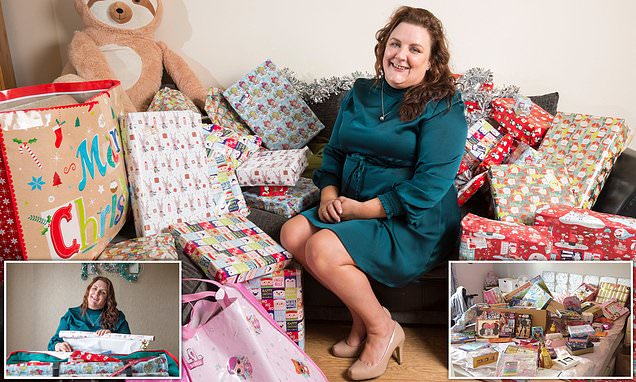
The width and height of the screenshot is (636, 382). Identify the location of gifts in red paper. (493, 246), (589, 230), (528, 117), (509, 146), (474, 189), (266, 190).